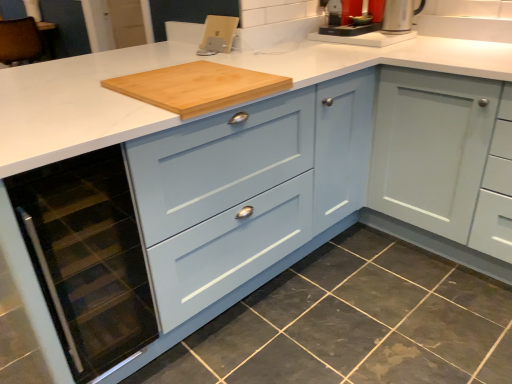
In order to face silver metallic coffee machine at upper center, should I rotate leftwards or rightwards?

Turn right approximately 12.573 degrees to face it.

Describe the element at coordinates (349, 321) in the screenshot. I see `dark gray granite at lower left` at that location.

The width and height of the screenshot is (512, 384). What do you see at coordinates (248, 188) in the screenshot?
I see `light blue wood cabinet at center` at bounding box center [248, 188].

In order to face light blue wood cabinet at center, should I rotate leftwards or rightwards?

To face it directly, rotate left by 12.231 degrees.

At what (x,y) coordinates should I click in order to perform the action: click on silver metallic coffee machine at upper center. Please return your answer as a coordinate pair (x, y). Image resolution: width=512 pixels, height=384 pixels. Looking at the image, I should click on (372, 24).

In terms of width, does matte glass oven at lower left look wider or thinner when compared to light blue wood cabinet at center?

matte glass oven at lower left is thinner than light blue wood cabinet at center.

Considering the relative positions of matte glass oven at lower left and light blue wood cabinet at center in the image provided, is matte glass oven at lower left to the right of light blue wood cabinet at center from the viewer's perspective?

In fact, matte glass oven at lower left is to the left of light blue wood cabinet at center.

Is matte glass oven at lower left bigger than light blue wood cabinet at center?

Actually, matte glass oven at lower left might be smaller than light blue wood cabinet at center.

Between point (407, 9) and point (80, 358), which one is positioned in front?

The point (80, 358) is more forward.

Based on the photo, who is taller, silver metallic kettle at upper right or matte glass oven at lower left?

Standing taller between the two is matte glass oven at lower left.

Is silver metallic kettle at upper right facing away from matte glass oven at lower left?

No, silver metallic kettle at upper right's orientation is not away from matte glass oven at lower left.

Looking at their sizes, would you say silver metallic kettle at upper right is wider or thinner than matte glass oven at lower left?

silver metallic kettle at upper right is thinner than matte glass oven at lower left.

From a real-world perspective, is matte glass oven at lower left located higher than silver metallic coffee machine at upper center?

No, from a real-world perspective, matte glass oven at lower left is not on top of silver metallic coffee machine at upper center.

Is matte glass oven at lower left positioned with its back to silver metallic coffee machine at upper center?

No, matte glass oven at lower left's orientation is not away from silver metallic coffee machine at upper center.

In order to click on coffee machine behind the matte glass oven at lower left in this screenshot , I will do `click(372, 24)`.

From the image's perspective, does matte glass oven at lower left appear lower than silver metallic coffee machine at upper center?

Yes, from the image's perspective, matte glass oven at lower left is beneath silver metallic coffee machine at upper center.

Is dark gray granite at lower left completely or partially outside of matte glass oven at lower left?

Yes, dark gray granite at lower left is outside of matte glass oven at lower left.

Is the depth of dark gray granite at lower left greater than that of matte glass oven at lower left?

No.

Between point (390, 364) and point (92, 170), which one is positioned behind?

The point (390, 364) is more distant.

Which is correct: silver metallic kettle at upper right is inside silver metallic coffee machine at upper center, or outside of it?

silver metallic kettle at upper right is outside silver metallic coffee machine at upper center.

Considering the points (390, 12) and (327, 28), which point is behind, point (390, 12) or point (327, 28)?

The point (327, 28) is farther.

Does silver metallic kettle at upper right have a greater width compared to silver metallic coffee machine at upper center?

In fact, silver metallic kettle at upper right might be narrower than silver metallic coffee machine at upper center.

Is silver metallic kettle at upper right next to silver metallic coffee machine at upper center?

Yes, silver metallic kettle at upper right is touching silver metallic coffee machine at upper center.

Is natural wood cutting board at center positioned beyond the bounds of light blue wood cabinet at center?

Actually, natural wood cutting board at center is at least partially inside light blue wood cabinet at center.

From a real-world perspective, who is located lower, natural wood cutting board at center or light blue wood cabinet at center?

light blue wood cabinet at center, from a real-world perspective.

Does natural wood cutting board at center turn towards light blue wood cabinet at center?

Yes, natural wood cutting board at center is facing light blue wood cabinet at center.

Which of these two, natural wood cutting board at center or light blue wood cabinet at center, is smaller?

natural wood cutting board at center.

Is silver metallic coffee machine at upper center at the left side of matte glass oven at lower left?

No.

Can you confirm if silver metallic coffee machine at upper center is thinner than matte glass oven at lower left?

Incorrect, the width of silver metallic coffee machine at upper center is not less than that of matte glass oven at lower left.

In the image, there is a silver metallic coffee machine at upper center. At what (x,y) coordinates should I click in order to perform the action: click on oven below it (from the image's perspective). Please return your answer as a coordinate pair (x, y). This screenshot has width=512, height=384. Looking at the image, I should click on (87, 257).

Where is `oven behind the light blue wood cabinet at center`? The image size is (512, 384). oven behind the light blue wood cabinet at center is located at coordinates (87, 257).

Identify the location of oven located underneath the silver metallic kettle at upper right (from a real-world perspective). This screenshot has width=512, height=384. (87, 257).

Considering their positions, is matte glass oven at lower left positioned further to natural wood cutting board at center than silver metallic coffee machine at upper center?

silver metallic coffee machine at upper center.

Which object lies further to the anchor point silver metallic kettle at upper right, matte glass oven at lower left or silver metallic coffee machine at upper center?

Based on the image, matte glass oven at lower left appears to be further to silver metallic kettle at upper right.

From the image, which object appears to be farther from silver metallic kettle at upper right, light blue wood cabinet at center or natural wood cutting board at center?

natural wood cutting board at center lies further to silver metallic kettle at upper right than the other object.

Considering their positions, is light blue wood cabinet at center positioned closer to dark gray granite at lower left than matte glass oven at lower left?

light blue wood cabinet at center is positioned closer to the anchor dark gray granite at lower left.

Looking at the image, which one is located closer to matte glass oven at lower left, natural wood cutting board at center or silver metallic kettle at upper right?

The object closer to matte glass oven at lower left is natural wood cutting board at center.

Based on their spatial positions, is natural wood cutting board at center or silver metallic coffee machine at upper center closer to silver metallic kettle at upper right?

The object closer to silver metallic kettle at upper right is silver metallic coffee machine at upper center.

When comparing their distances from natural wood cutting board at center, does silver metallic kettle at upper right or light blue wood cabinet at center seem closer?

light blue wood cabinet at center.

Looking at the image, which one is located closer to silver metallic coffee machine at upper center, silver metallic kettle at upper right or natural wood cutting board at center?

silver metallic kettle at upper right is closer to silver metallic coffee machine at upper center.

The image size is (512, 384). In order to click on cutting board between silver metallic coffee machine at upper center and dark gray granite at lower left in the up-down direction in this screenshot , I will do (197, 87).

Identify the location of appliance that lies between silver metallic coffee machine at upper center and matte glass oven at lower left from top to bottom. (399, 16).

Locate an element on the screen. The width and height of the screenshot is (512, 384). cutting board between silver metallic coffee machine at upper center and matte glass oven at lower left in the vertical direction is located at coordinates (197, 87).

You are a GUI agent. You are given a task and a screenshot of the screen. Output one action in this format:
    pyautogui.click(x=<x>, y=<y>)
    Task: Click on the coffee machine between natural wood cutting board at center and silver metallic kettle at upper right from left to right
    This screenshot has height=384, width=512.
    Given the screenshot: What is the action you would take?
    pyautogui.click(x=372, y=24)